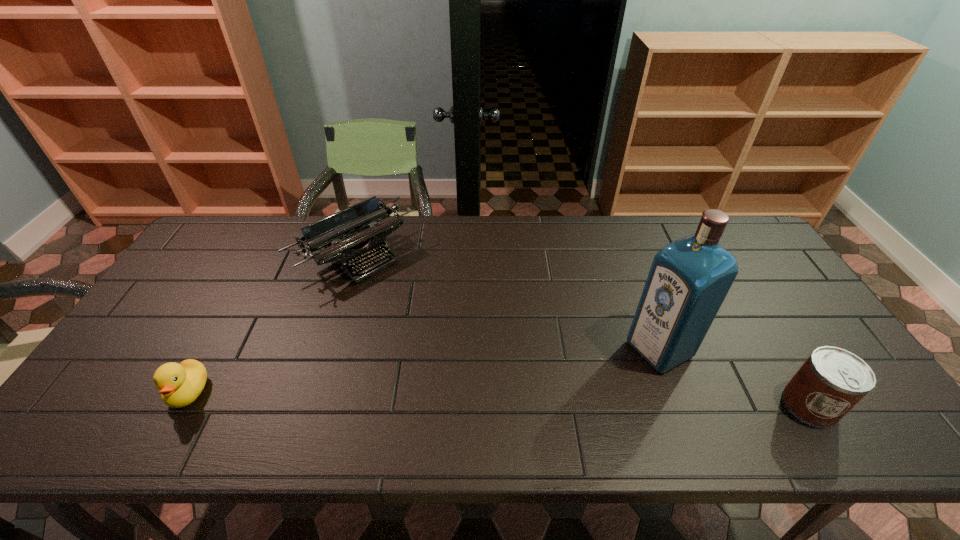
The width and height of the screenshot is (960, 540). What are the coordinates of `free spot on the desktop that is between the shortest object and the rightmost object and is positioned on the flat label side of the liquor` in the screenshot? It's located at (564, 400).

Identify the location of vacant spot on the desktop that is between the shortest object and the rightmost object and is positioned on the typing side of the second object from left to right. The height and width of the screenshot is (540, 960). (508, 399).